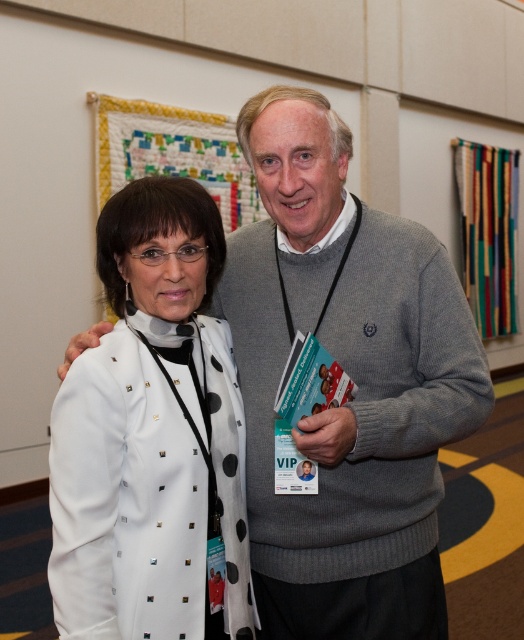
You are an event photographer who needs to capture a clear shot of the teal paper booklet at center without the white studded coat at left blocking it. Can you adjust your camera angle to achieve this?

The white studded coat at left is located above the teal paper booklet at center, so tilting the camera downward slightly should allow you to frame the teal paper booklet at center without the coat obstructing the view.

You are organizing a coat check area and need to store the white studded coat at left and the teal paper booklet at center. Which item requires more space for storage?

The white studded coat at left requires more storage space since it has a larger size compared to the teal paper booklet at center.

You are a photographer at the event and need to capture a photo of the white studded coat at left and the teal paper booklet at center. The camera can only focus on objects above 30 cm in height. Can both objects be in focus?

The white studded coat at left is taller than the teal paper booklet at center. Since the coat is taller than the booklet, and assuming the booklet is at least 30 cm, both could be in focus. However, without knowing the exact height of the booklet, we can only confirm the coat meets the requirement. If the booklet is under 30 cm, it won